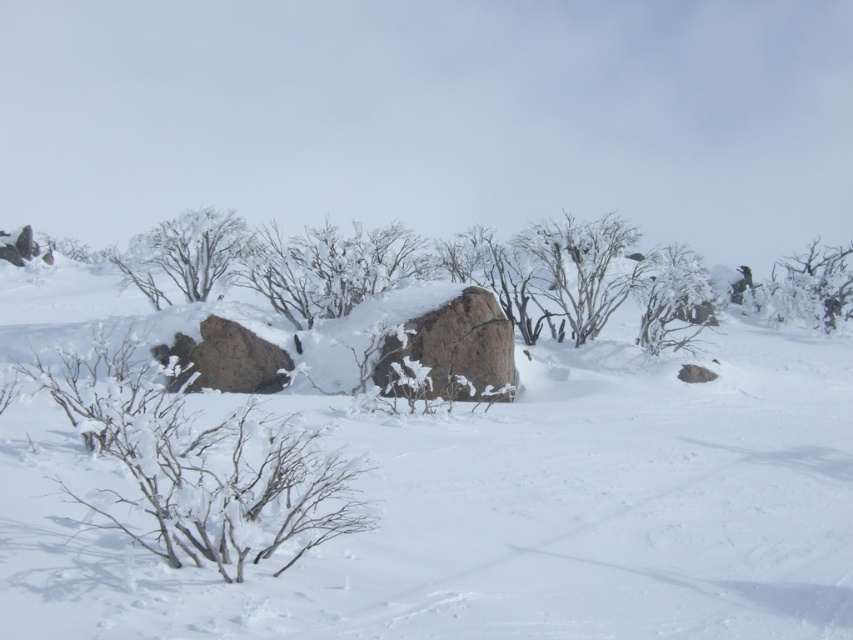
Can you confirm if white snow-covered shrub at center is bigger than brown rough boulder at center?

Correct, white snow-covered shrub at center is larger in size than brown rough boulder at center.

Is white snow-covered shrub at center positioned behind brown rough boulder at center?

Yes.

Where is `white snow-covered shrub at center`? Image resolution: width=853 pixels, height=640 pixels. white snow-covered shrub at center is located at coordinates (328, 268).

Is snow-covered branches at lower left wider than white snow-covered shrub at center?

No, snow-covered branches at lower left is not wider than white snow-covered shrub at center.

Which of these two, snow-covered branches at lower left or white snow-covered shrub at center, stands taller?

white snow-covered shrub at center is taller.

At what (x,y) coordinates should I click in order to perform the action: click on snow-covered branches at lower left. Please return your answer as a coordinate pair (x, y). This screenshot has width=853, height=640. Looking at the image, I should click on (196, 461).

Is white fluffy snow at center to the right of white snow-covered shrub at center from the viewer's perspective?

Yes, white fluffy snow at center is to the right of white snow-covered shrub at center.

This screenshot has height=640, width=853. Describe the element at coordinates (503, 509) in the screenshot. I see `white fluffy snow at center` at that location.

Is point (811, 532) positioned after point (422, 257)?

No, (811, 532) is in front of (422, 257).

Find the location of a particular element. white fluffy snow at center is located at coordinates (503, 509).